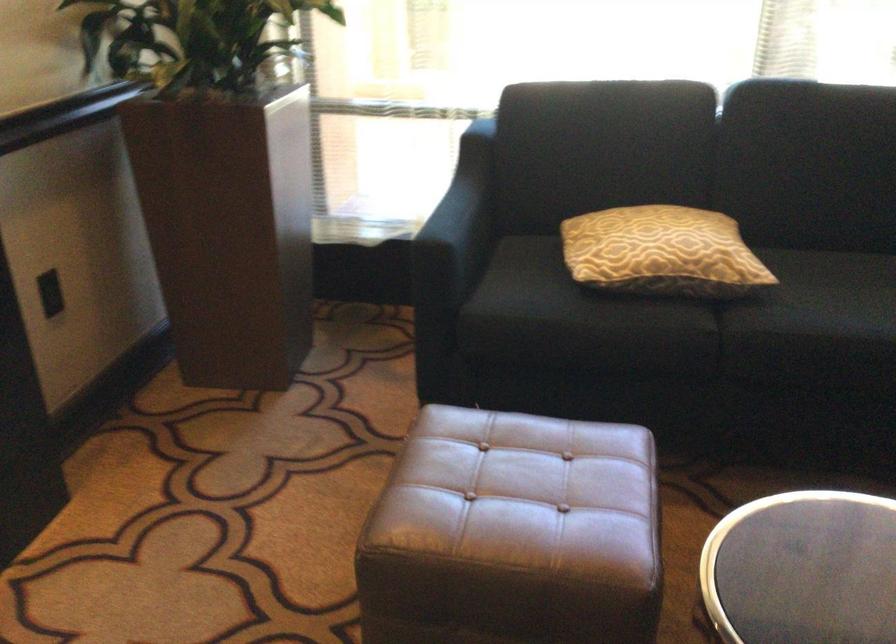
You are a GUI agent. You are given a task and a screenshot of the screen. Output one action in this format:
    pyautogui.click(x=<x>, y=<y>)
    Task: Click on the sofa armrest
    This screenshot has width=896, height=644.
    Given the screenshot: What is the action you would take?
    pyautogui.click(x=458, y=225)